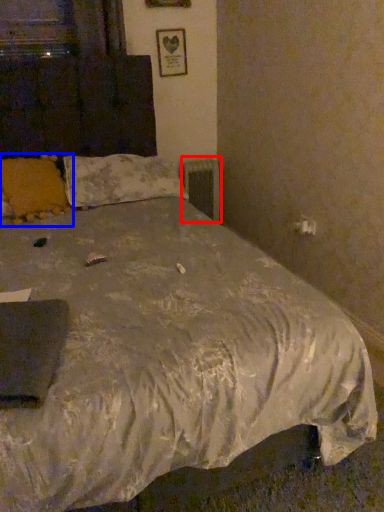
Question: Which object is closer to the camera taking this photo, radiator (highlighted by a red box) or pillow (highlighted by a blue box)?

Choices:
 (A) radiator
 (B) pillow

Answer: (B)